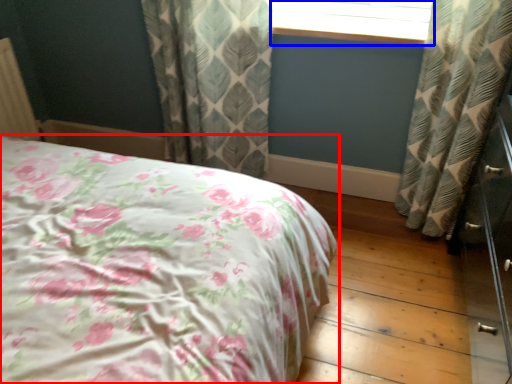
Question: Among these objects, which one is nearest to the camera, bed (highlighted by a red box) or window frame (highlighted by a blue box)?

Choices:
 (A) bed
 (B) window frame

Answer: (A)